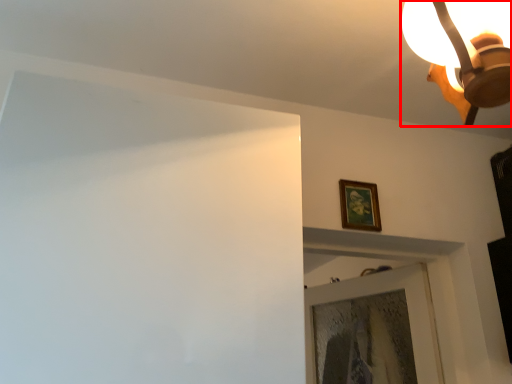
Question: From the image's perspective, considering the relative positions of lamp (annotated by the red box) and picture frame in the image provided, where is lamp (annotated by the red box) located with respect to the staircase?

Choices:
 (A) below
 (B) above

Answer: (B)